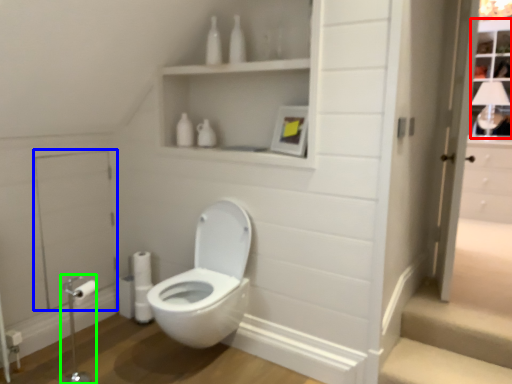
Question: Considering the real-world distances, which object is farthest from window (highlighted by a red box)? screen door (highlighted by a blue box) or towel bar (highlighted by a green box)?

Choices:
 (A) screen door
 (B) towel bar

Answer: (B)